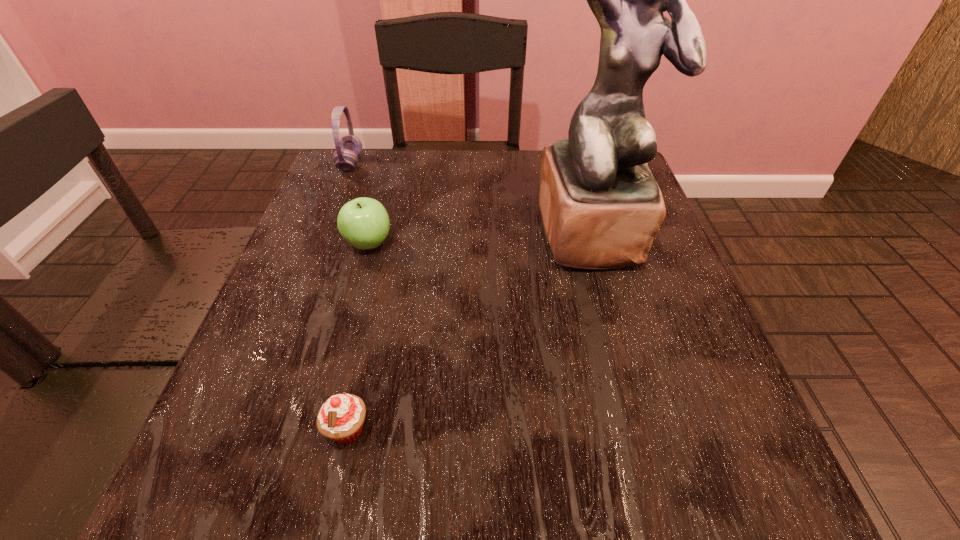
The height and width of the screenshot is (540, 960). Find the location of `blank region between the tallest object and the third tallest object`. blank region between the tallest object and the third tallest object is located at coordinates 480,238.

Find the location of a particular element. This screenshot has width=960, height=540. free space between the headset and the shortest object is located at coordinates pos(348,296).

You are a GUI agent. You are given a task and a screenshot of the screen. Output one action in this format:
    pyautogui.click(x=<x>, y=<y>)
    Task: Click on the empty space between the third tallest object and the nearest object
    Image resolution: width=960 pixels, height=540 pixels.
    Given the screenshot: What is the action you would take?
    pyautogui.click(x=358, y=336)

Identify the location of free space between the rightmost object and the second shortest object. The width and height of the screenshot is (960, 540). (480, 238).

Locate an element on the screen. vacant area that lies between the shortest object and the tallest object is located at coordinates (469, 330).

The height and width of the screenshot is (540, 960). Find the location of `the third closest object relative to the tallest object`. the third closest object relative to the tallest object is located at coordinates (349, 147).

Identify the location of object that is the second nearest to the apple. (601, 207).

Identify the location of free space that satisfies the following two spatial constraints: 1. on the headband and ear cups of the farthest object; 2. on the right side of the nearest object. (246, 429).

What are the coordinates of `free space that satisfies the following two spatial constraints: 1. on the headband and ear cups of the leftmost object; 2. on the left side of the apple` in the screenshot? It's located at (319, 244).

The height and width of the screenshot is (540, 960). In order to click on vacant space that satisfies the following two spatial constraints: 1. on the headband and ear cups of the headset; 2. on the back side of the third tallest object in this screenshot , I will do `click(319, 244)`.